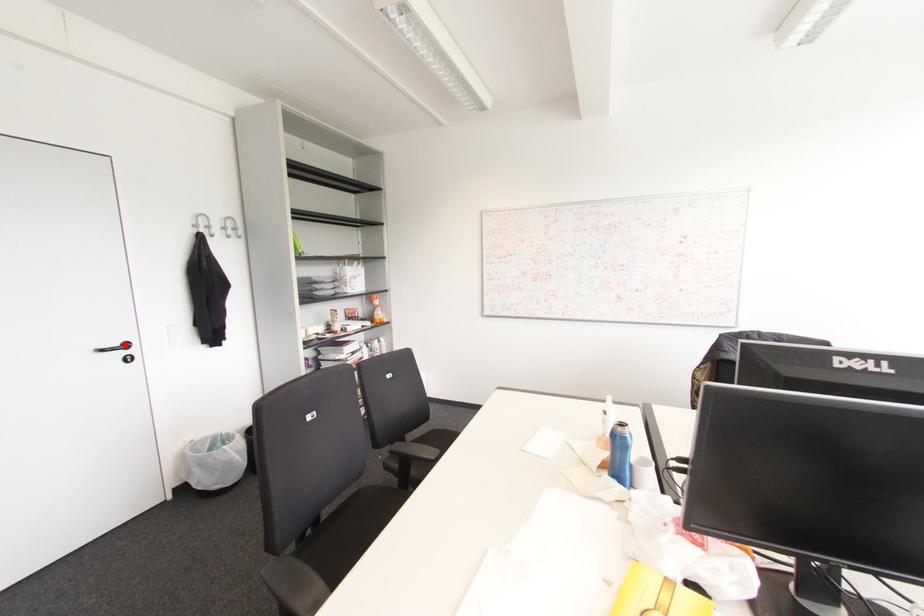
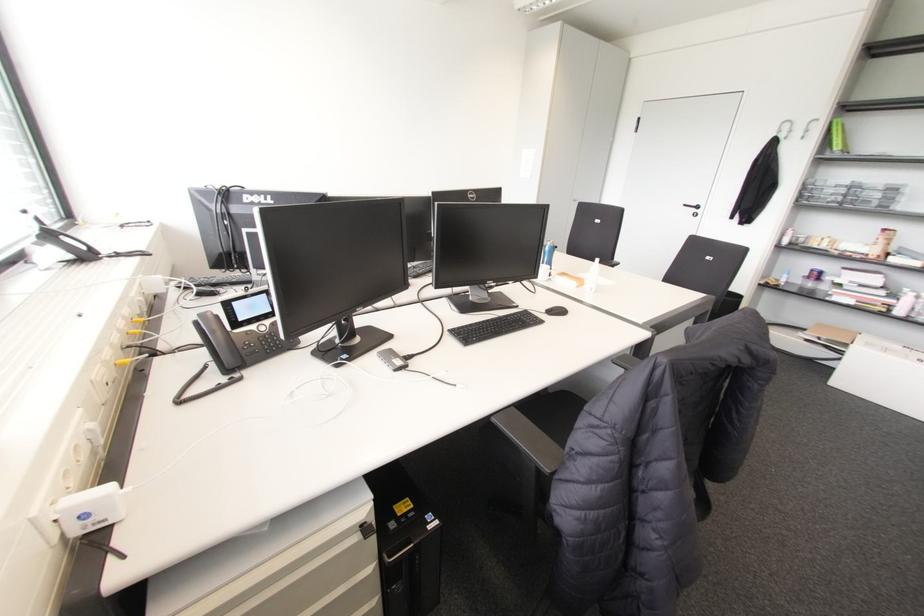
In the second image, find the point that corresponds to the highlighted location in the first image.

(697, 207)